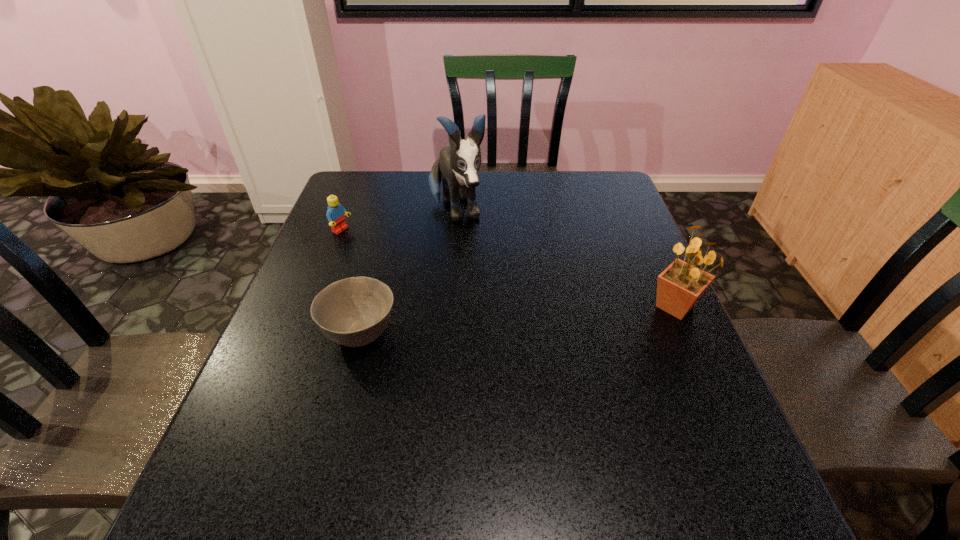
This screenshot has width=960, height=540. In order to click on free space on the desktop that is between the third object from right to left and the third shortest object and is positioned on the face of the Lego in this screenshot , I will do `click(534, 319)`.

Locate an element on the screen. Image resolution: width=960 pixels, height=540 pixels. vacant spot on the desktop that is between the second object from left to right and the second tallest object and is positioned on the front-facing side of the third object from left to right is located at coordinates (505, 321).